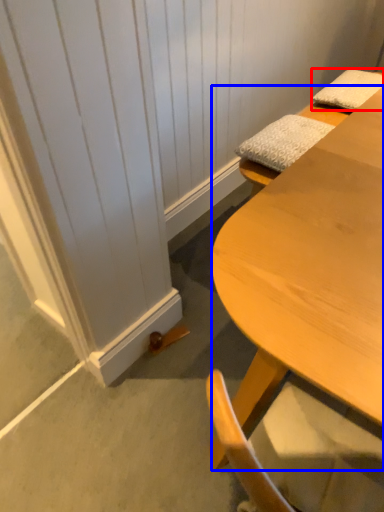
Question: Which point is closer to the camera, pillow (highlighted by a red box) or desk (highlighted by a blue box)?

Choices:
 (A) pillow
 (B) desk

Answer: (B)